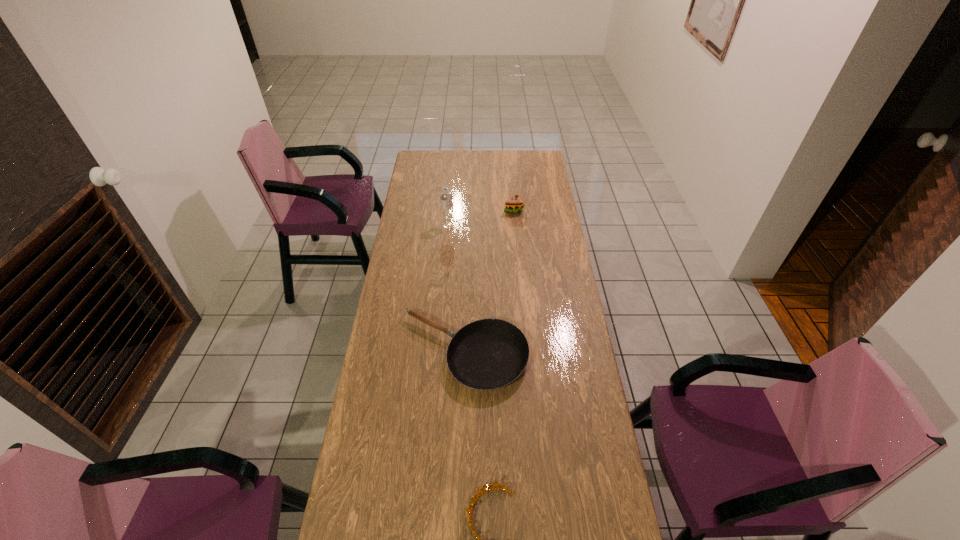
In order to click on water bottle in this screenshot , I will do `click(447, 218)`.

What are the coordinates of `the third nearest object` in the screenshot? It's located at [x=447, y=218].

Image resolution: width=960 pixels, height=540 pixels. Identify the location of sandwich. (515, 204).

Where is `the third shortest object`? The width and height of the screenshot is (960, 540). the third shortest object is located at coordinates (515, 204).

Find the location of a particular element. frying pan is located at coordinates (487, 354).

Locate an element on the screen. This screenshot has width=960, height=540. the shortest object is located at coordinates (487, 354).

Locate an element on the screen. vacant region located 0.330m on the back of the tallest object is located at coordinates (451, 184).

The height and width of the screenshot is (540, 960). I want to click on free space located on the left of the third shortest object, so click(x=456, y=210).

The width and height of the screenshot is (960, 540). In order to click on free space located 0.090m on the front of the second nearest object in this screenshot , I will do [x=462, y=422].

Locate an element on the screen. This screenshot has height=540, width=960. object at the left edge is located at coordinates (487, 354).